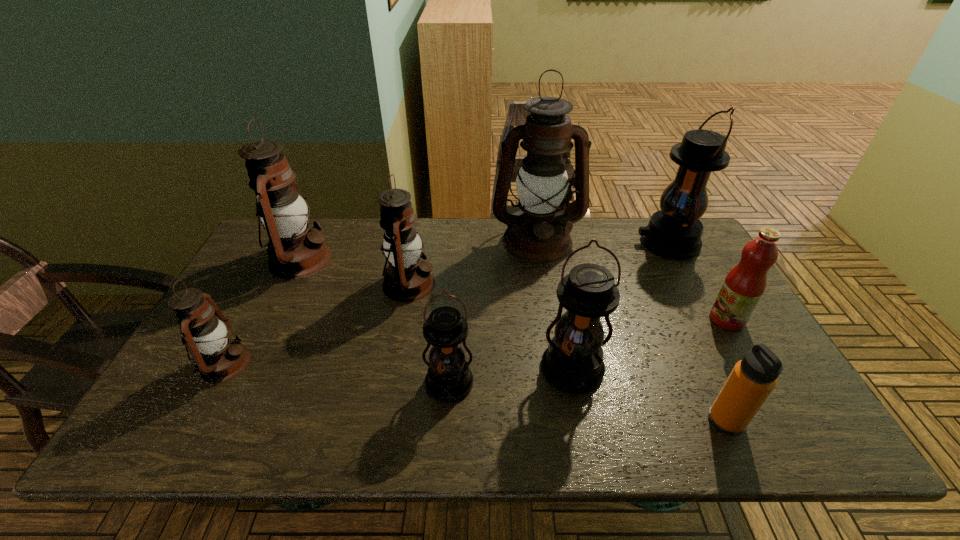
What are the coordinates of `the rightmost brown lantern` in the screenshot? It's located at (538, 233).

Identify the location of the biggest brown lantern. This screenshot has width=960, height=540. (538, 233).

Identify the location of the rightmost black lantern. This screenshot has width=960, height=540. (674, 232).

Locate an element on the screen. the biggest black lantern is located at coordinates (674, 232).

At what (x,y) coordinates should I click in order to perform the action: click on the third smallest brown lantern. Please return your answer as a coordinate pair (x, y). Looking at the image, I should click on (295, 251).

You are a GUI agent. You are given a task and a screenshot of the screen. Output one action in this format:
    pyautogui.click(x=<x>, y=<y>)
    Task: Click on the fifth lantern from right to left
    This screenshot has width=960, height=540.
    Given the screenshot: What is the action you would take?
    pyautogui.click(x=407, y=278)

Locate an element on the screen. This screenshot has width=960, height=540. the third brown lantern from left to right is located at coordinates (407, 278).

This screenshot has width=960, height=540. Identify the location of the second black lantern from left to right. (573, 362).

Where is `pink fruit juice`? The width and height of the screenshot is (960, 540). pink fruit juice is located at coordinates (743, 287).

The height and width of the screenshot is (540, 960). Identify the location of the nearest brown lantern. (218, 358).